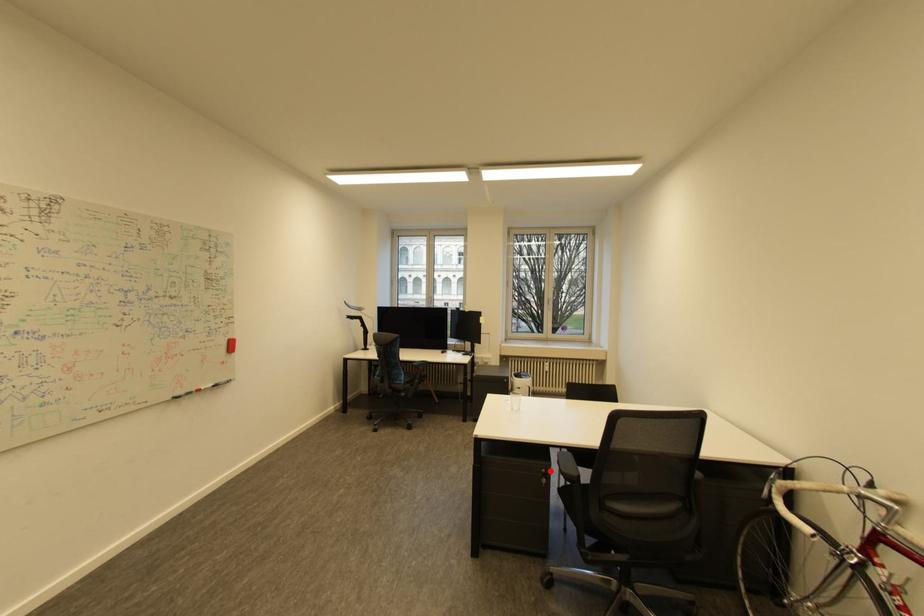
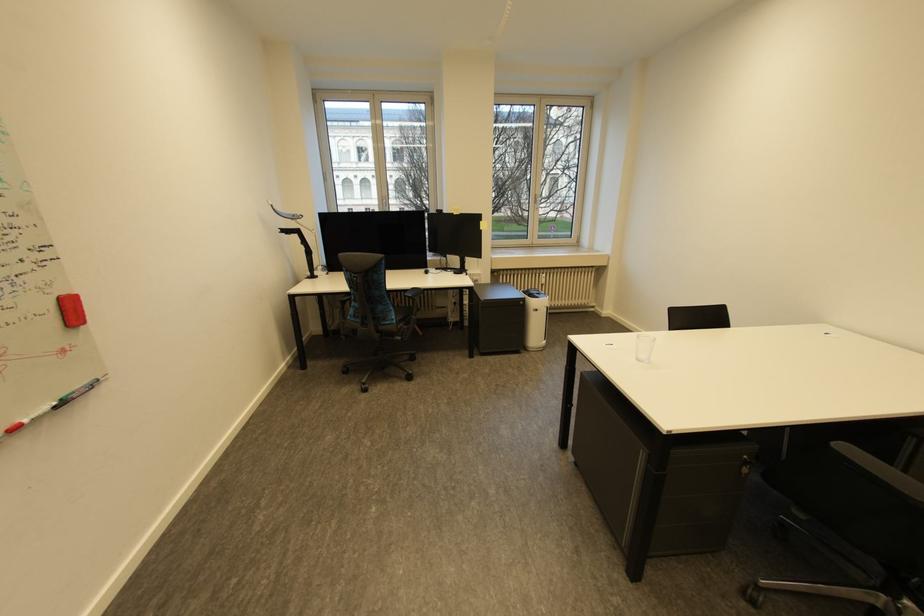
Question: I am providing you with two images of the same scene from different viewpoints. Given a red point in image1, look at the same physical point in image2. Is it:

Choices:
 (A) Closer to the viewpoint
 (B) Farther from the viewpoint

Answer: (A)